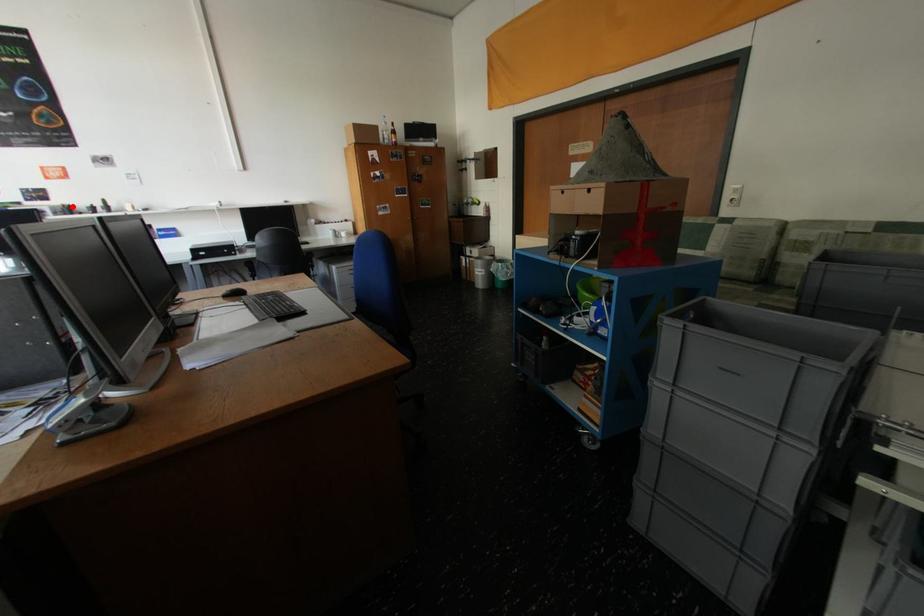
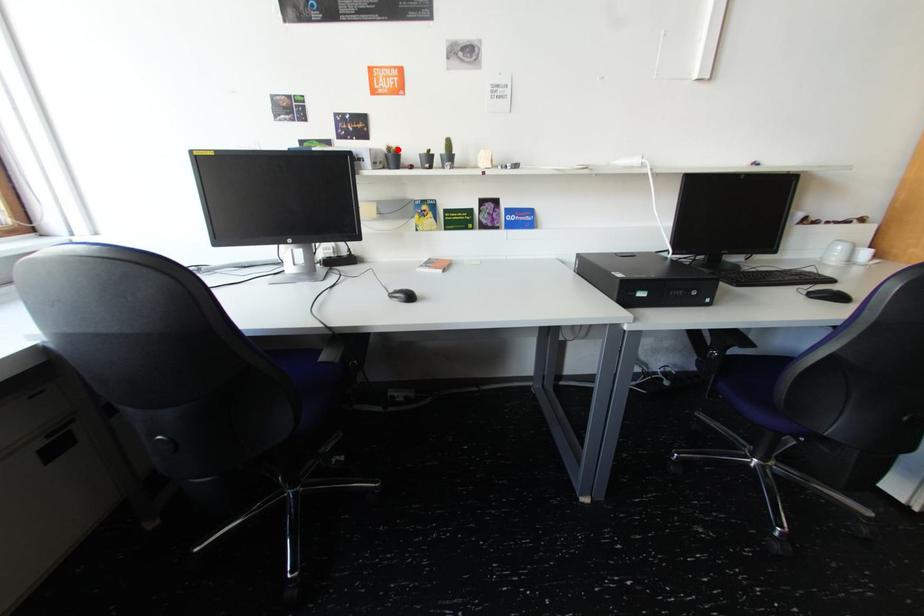
I am providing you with two images of the same scene from different viewpoints. A red point is marked on the first image and another point is marked on the second image. Do the highlighted points in image1 and image2 indicate the same real-world spot?

Yes